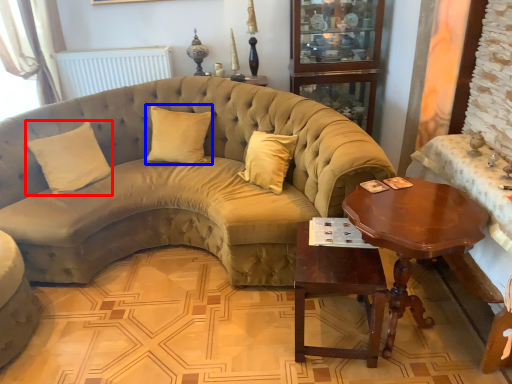
Question: Which point is closer to the camera, pillow (highlighted by a red box) or pillow (highlighted by a blue box)?

Choices:
 (A) pillow
 (B) pillow

Answer: (A)